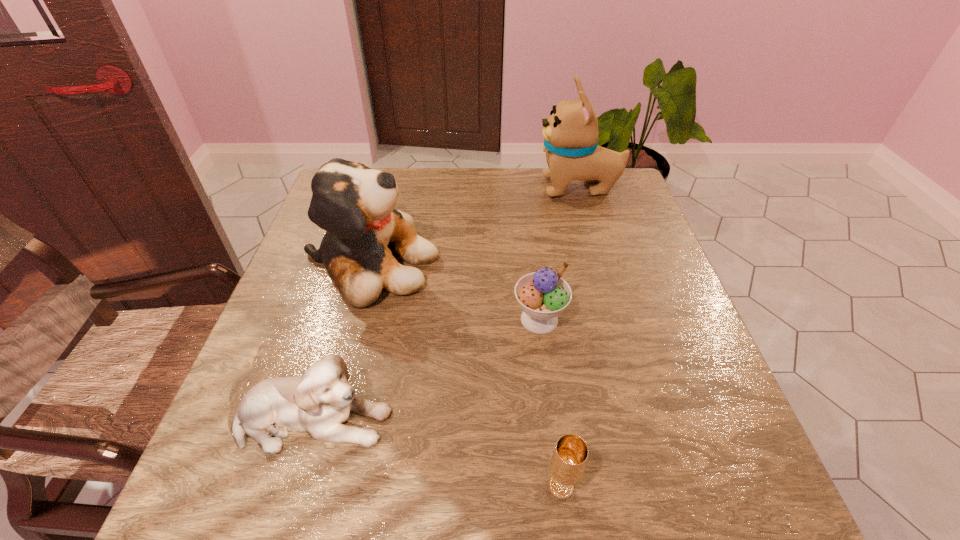
In order to click on vacant space situated at the face of the second farthest puppy in this screenshot , I will do [x=491, y=264].

Locate an element on the screen. vacant space located on the right of the icecream is located at coordinates (626, 319).

Where is `free space located on the front-facing side of the nearest puppy`? This screenshot has width=960, height=540. free space located on the front-facing side of the nearest puppy is located at coordinates (458, 420).

Identify the location of free space located on the left of the chalice. The width and height of the screenshot is (960, 540). (359, 487).

Image resolution: width=960 pixels, height=540 pixels. Identify the location of object that is at the far edge. (570, 134).

Locate an element on the screen. This screenshot has width=960, height=540. object present at the near edge is located at coordinates (569, 458).

I want to click on object at the right edge, so click(x=570, y=134).

The width and height of the screenshot is (960, 540). What are the coordinates of `object that is at the far right corner` in the screenshot? It's located at (570, 134).

At what (x,y) coordinates should I click in order to perform the action: click on free space at the far edge of the desktop. Please return your answer as a coordinate pair (x, y). This screenshot has height=540, width=960. Looking at the image, I should click on coord(416,194).

Identify the location of vacant space at the near edge of the desktop. This screenshot has width=960, height=540. (402, 511).